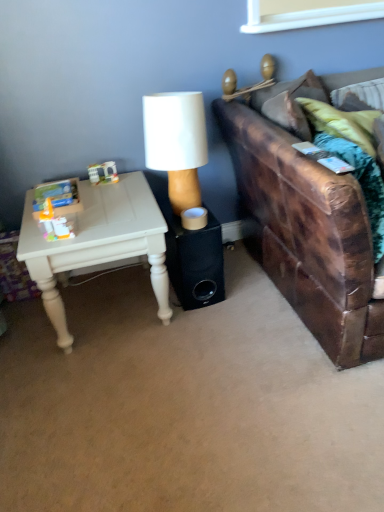
Where is `vacant space situated above white painted wood table at left (from a real-world perspective)`? This screenshot has width=384, height=512. vacant space situated above white painted wood table at left (from a real-world perspective) is located at coordinates (95, 207).